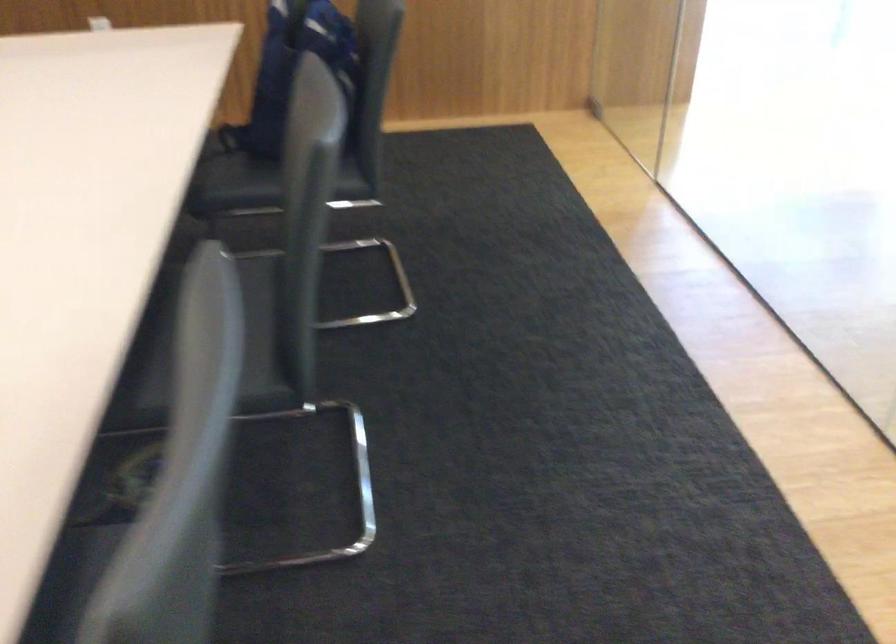
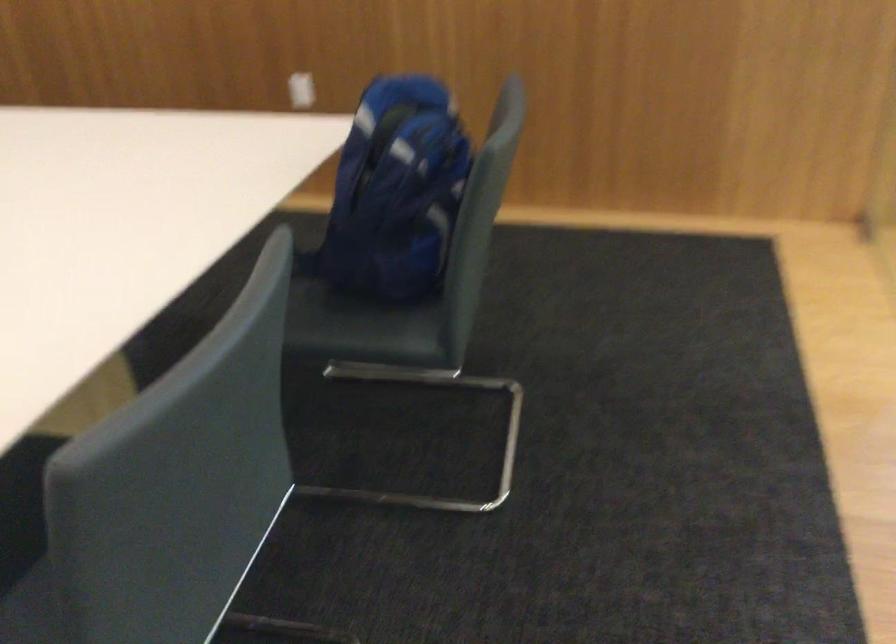
What movement of the cameraman would produce the second image?

The movement direction of the cameraman is right, forward.